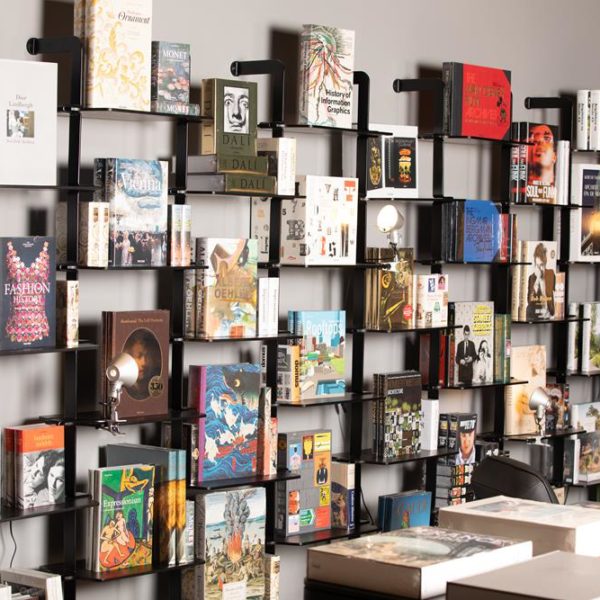
Locate an element on the screen. colorful book covers is located at coordinates (327, 357), (240, 427), (139, 516), (224, 529), (309, 482), (537, 159), (227, 280), (141, 207), (31, 296).